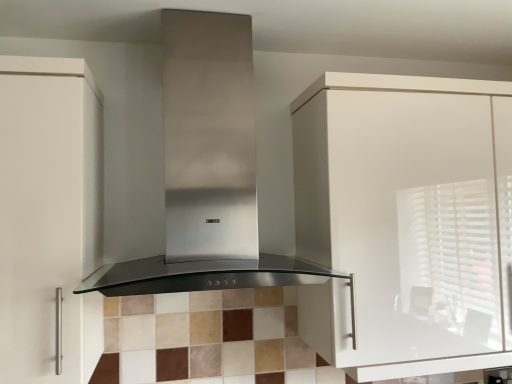
Question: Is white glossy cabinet at upper right, the 1th cabinetry from the right, a part of stainless steel range hood at center?

Choices:
 (A) yes
 (B) no

Answer: (B)

Question: Is stainless steel range hood at center oriented away from white glossy cabinet at upper right, the 1th cabinetry from the right?

Choices:
 (A) yes
 (B) no

Answer: (B)

Question: Can you confirm if stainless steel range hood at center is thinner than white glossy cabinet at upper right, the 1th cabinetry from the right?

Choices:
 (A) no
 (B) yes

Answer: (A)

Question: Is stainless steel range hood at center not near white glossy cabinet at upper right, which is the 2th cabinetry in left-to-right order?

Choices:
 (A) no
 (B) yes

Answer: (A)

Question: Does stainless steel range hood at center appear on the right side of white glossy cabinet at upper right, the 1th cabinetry from the right?

Choices:
 (A) yes
 (B) no

Answer: (B)

Question: Is point (13, 284) positioned closer to the camera than point (463, 203)?

Choices:
 (A) farther
 (B) closer

Answer: (B)

Question: Visually, is white matte cabinet at left, the 1th cabinetry viewed from the left, positioned to the left or to the right of white glossy cabinet at upper right, the 1th cabinetry from the right?

Choices:
 (A) left
 (B) right

Answer: (A)

Question: Considering the positions of white matte cabinet at left, the 1th cabinetry viewed from the left, and white glossy cabinet at upper right, which is the 2th cabinetry in left-to-right order, in the image, is white matte cabinet at left, the 1th cabinetry viewed from the left, bigger or smaller than white glossy cabinet at upper right, which is the 2th cabinetry in left-to-right order,?

Choices:
 (A) big
 (B) small

Answer: (B)

Question: Is white matte cabinet at left, the second cabinetry viewed from the right, taller or shorter than white glossy cabinet at upper right, the 1th cabinetry from the right?

Choices:
 (A) short
 (B) tall

Answer: (B)

Question: From their relative heights in the image, would you say stainless steel range hood at center is taller or shorter than white glossy cabinet at upper right, the 1th cabinetry from the right?

Choices:
 (A) tall
 (B) short

Answer: (B)

Question: In terms of width, does stainless steel range hood at center look wider or thinner when compared to white glossy cabinet at upper right, which is the 2th cabinetry in left-to-right order?

Choices:
 (A) thin
 (B) wide

Answer: (B)

Question: From a real-world perspective, is stainless steel range hood at center physically located above or below white glossy cabinet at upper right, the 1th cabinetry from the right?

Choices:
 (A) above
 (B) below

Answer: (A)

Question: Considering the relative positions of stainless steel range hood at center and white glossy cabinet at upper right, which is the 2th cabinetry in left-to-right order, in the image provided, is stainless steel range hood at center to the left or to the right of white glossy cabinet at upper right, which is the 2th cabinetry in left-to-right order,?

Choices:
 (A) left
 (B) right

Answer: (A)

Question: Visually, is stainless steel range hood at center positioned to the left or to the right of white matte cabinet at left, the second cabinetry viewed from the right?

Choices:
 (A) left
 (B) right

Answer: (B)

Question: Is point (242, 185) positioned closer to the camera than point (80, 170)?

Choices:
 (A) farther
 (B) closer

Answer: (A)